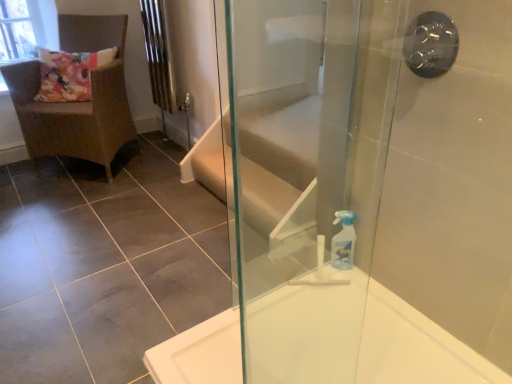
Question: Can you confirm if brown woven chair at upper left is wider than black metallic shower handle at upper right?

Choices:
 (A) no
 (B) yes

Answer: (B)

Question: Does brown woven chair at upper left touch black metallic shower handle at upper right?

Choices:
 (A) no
 (B) yes

Answer: (A)

Question: Is brown woven chair at upper left in front of black metallic shower handle at upper right?

Choices:
 (A) no
 (B) yes

Answer: (A)

Question: Does brown woven chair at upper left have a greater height compared to black metallic shower handle at upper right?

Choices:
 (A) yes
 (B) no

Answer: (A)

Question: Is brown woven chair at upper left shorter than black metallic shower handle at upper right?

Choices:
 (A) yes
 (B) no

Answer: (B)

Question: From a real-world perspective, relative to white glossy bathtub at lower right, is brown woven chair at upper left vertically above or below?

Choices:
 (A) above
 (B) below

Answer: (A)

Question: Considering the positions of brown woven chair at upper left and white glossy bathtub at lower right in the image, is brown woven chair at upper left wider or thinner than white glossy bathtub at lower right?

Choices:
 (A) wide
 (B) thin

Answer: (B)

Question: Based on their positions, is brown woven chair at upper left located to the left or right of white glossy bathtub at lower right?

Choices:
 (A) right
 (B) left

Answer: (B)

Question: From the image's perspective, is brown woven chair at upper left located above or below white glossy bathtub at lower right?

Choices:
 (A) above
 (B) below

Answer: (A)

Question: Would you say transparent glass window screen at upper left is to the left or to the right of transparent glass screen door at right in the picture?

Choices:
 (A) left
 (B) right

Answer: (A)

Question: Is transparent glass window screen at upper left inside the boundaries of transparent glass screen door at right, or outside?

Choices:
 (A) inside
 (B) outside

Answer: (B)

Question: Relative to transparent glass screen door at right, is transparent glass window screen at upper left in front or behind?

Choices:
 (A) front
 (B) behind

Answer: (B)

Question: Does point (31, 33) appear closer or farther from the camera than point (272, 286)?

Choices:
 (A) farther
 (B) closer

Answer: (A)

Question: From a real-world perspective, relative to brown woven chair at upper left, is transparent glass window screen at upper left vertically above or below?

Choices:
 (A) below
 (B) above

Answer: (B)

Question: Is point (52, 36) positioned closer to the camera than point (23, 87)?

Choices:
 (A) farther
 (B) closer

Answer: (A)